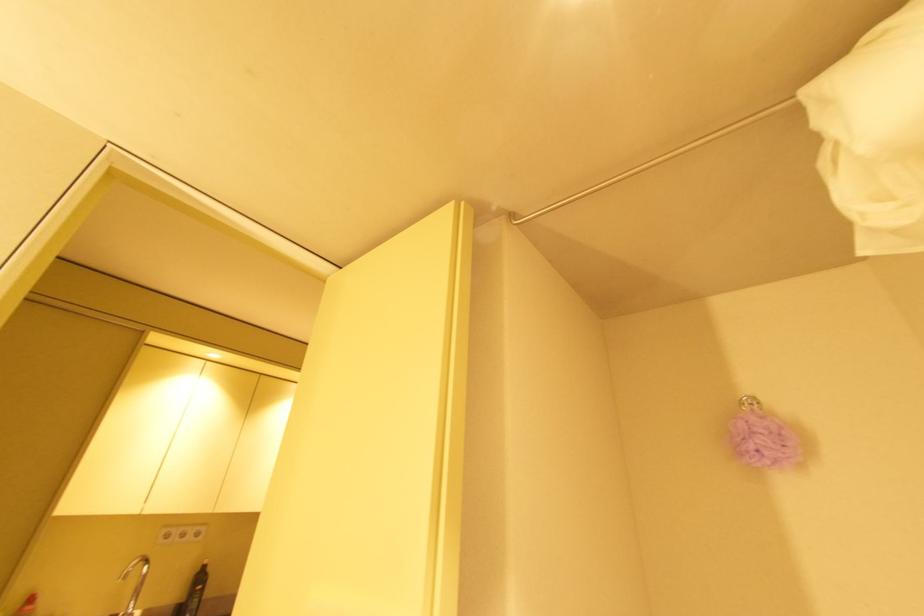
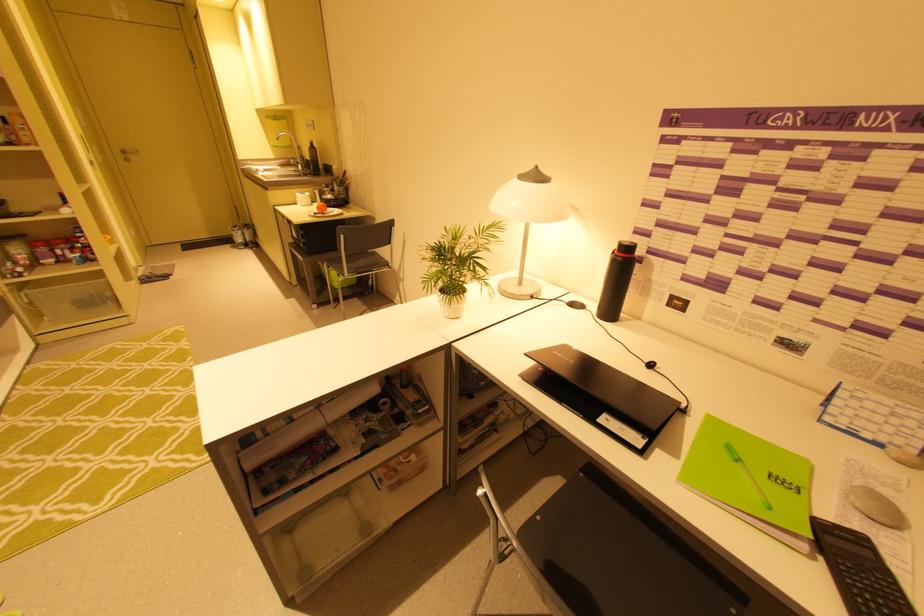
Locate, in the second image, the point that corresponds to (204,570) in the first image.

(313, 146)